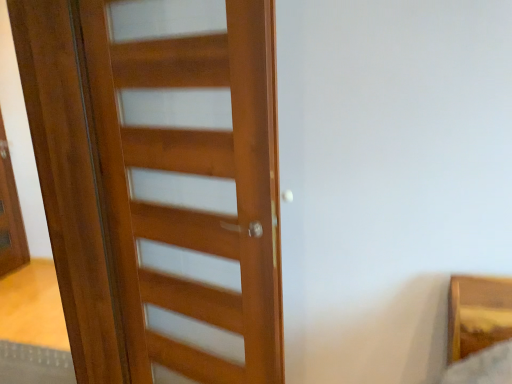
Identify the location of matte wooden screen door at left. (10, 214).

The width and height of the screenshot is (512, 384). What do you see at coordinates (10, 214) in the screenshot?
I see `matte wooden screen door at left` at bounding box center [10, 214].

You are a GUI agent. You are given a task and a screenshot of the screen. Output one action in this format:
    pyautogui.click(x=<x>, y=<y>)
    Task: Click on the wooden door at left
    Image resolution: width=512 pixels, height=384 pixels.
    Given the screenshot: What is the action you would take?
    pyautogui.click(x=201, y=175)

This screenshot has height=384, width=512. Describe the element at coordinates (201, 175) in the screenshot. I see `wooden door at left` at that location.

In order to click on matte wooden screen door at left in this screenshot , I will do `click(10, 214)`.

Is matte wooden screen door at left to the right of wooden door at left from the viewer's perspective?

Incorrect, matte wooden screen door at left is not on the right side of wooden door at left.

Considering the relative positions of matte wooden screen door at left and wooden door at left in the image provided, is matte wooden screen door at left behind wooden door at left?

Yes, it is behind wooden door at left.

Which is less distant, [8,212] or [250,61]?

The point [250,61] is in front.

Consider the image. From the image's perspective, between matte wooden screen door at left and wooden door at left, who is located below?

wooden door at left, from the image's perspective.

From a real-world perspective, is matte wooden screen door at left physically located above or below wooden door at left?

In terms of real-world spatial position, matte wooden screen door at left is below wooden door at left.

Is matte wooden screen door at left thinner than wooden door at left?

Yes, matte wooden screen door at left is thinner than wooden door at left.

Who is taller, matte wooden screen door at left or wooden door at left?

With more height is wooden door at left.

Considering the relative sizes of matte wooden screen door at left and wooden door at left in the image provided, is matte wooden screen door at left bigger than wooden door at left?

Actually, matte wooden screen door at left might be smaller than wooden door at left.

Would you say matte wooden screen door at left is inside or outside wooden door at left?

matte wooden screen door at left is located beyond the bounds of wooden door at left.

Is matte wooden screen door at left positioned far away from wooden door at left?

That's right, there is a large distance between matte wooden screen door at left and wooden door at left.

Does matte wooden screen door at left turn towards wooden door at left?

No, matte wooden screen door at left is not oriented towards wooden door at left.

How distant is matte wooden screen door at left from wooden door at left?

matte wooden screen door at left is 8.08 feet from wooden door at left.

You are a GUI agent. You are given a task and a screenshot of the screen. Output one action in this format:
    pyautogui.click(x=<x>, y=<y>)
    Task: Click on the screen door that is above the wooden door at left (from the image's perspective)
    Image resolution: width=512 pixels, height=384 pixels.
    Given the screenshot: What is the action you would take?
    pyautogui.click(x=10, y=214)

Based on their positions, is wooden door at left located to the left or right of matte wooden screen door at left?

Based on their positions, wooden door at left is located to the right of matte wooden screen door at left.

From the picture: Which is in front, wooden door at left or matte wooden screen door at left?

Positioned in front is wooden door at left.

Between point (255, 137) and point (9, 213), which one is positioned in front?

Positioned in front is point (255, 137).

From the image's perspective, is wooden door at left below matte wooden screen door at left?

Yes.

From a real-world perspective, is wooden door at left positioned above or below matte wooden screen door at left?

Clearly, from a real-world perspective, wooden door at left is above matte wooden screen door at left.

Which of these two, wooden door at left or matte wooden screen door at left, is wider?

With larger width is wooden door at left.

Between wooden door at left and matte wooden screen door at left, which one has less height?

With less height is matte wooden screen door at left.

Which of these two, wooden door at left or matte wooden screen door at left, is smaller?

matte wooden screen door at left is smaller.

Is wooden door at left positioned beyond the bounds of matte wooden screen door at left?

Yes, wooden door at left is located beyond the bounds of matte wooden screen door at left.

Is wooden door at left with matte wooden screen door at left?

wooden door at left is not next to matte wooden screen door at left, and they're not touching.

Is wooden door at left positioned with its back to matte wooden screen door at left?

No.

How different are the orientations of wooden door at left and matte wooden screen door at left in degrees?

The facing directions of wooden door at left and matte wooden screen door at left are 118 degrees apart.

How much distance is there between wooden door at left and matte wooden screen door at left?

The distance of wooden door at left from matte wooden screen door at left is 8.08 feet.

Identify the location of screen door lying behind the wooden door at left. The image size is (512, 384). (10, 214).

Locate an element on the screen. The height and width of the screenshot is (384, 512). door that appears in front of the matte wooden screen door at left is located at coordinates (201, 175).

Identify the location of door positioned vertically above the matte wooden screen door at left (from a real-world perspective). (201, 175).